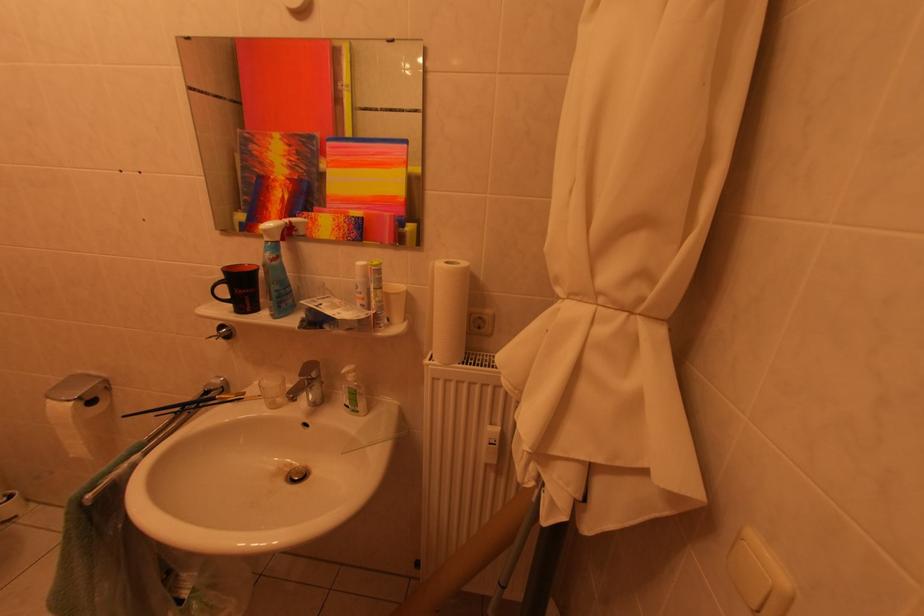
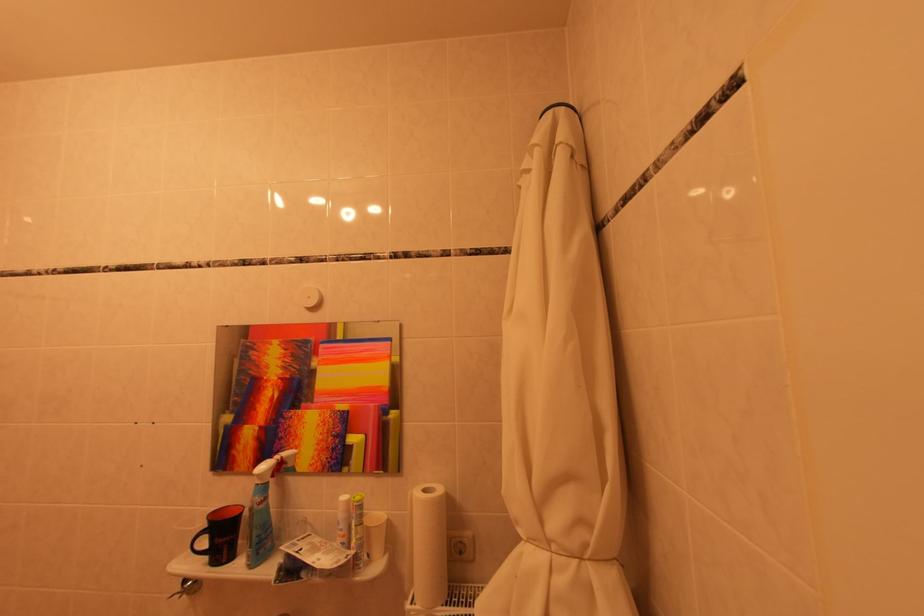
Where in the second image is the point corresponding to pixel 442 363 from the first image?

(423, 608)